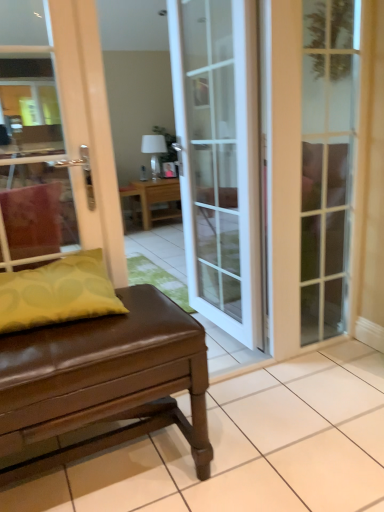
This screenshot has height=512, width=384. In order to click on yellow fabric pillow at left in this screenshot , I will do click(58, 292).

What do you see at coordinates (219, 158) in the screenshot? I see `white glass door at center, the second door in the right-to-left sequence` at bounding box center [219, 158].

In order to face clear glass door at right, the first door positioned from the right, should I rotate leftwards or rightwards?

You should rotate right by 17.655 degrees.

The image size is (384, 512). What do you see at coordinates (158, 199) in the screenshot?
I see `wooden table at center, the second table when ordered from front to back` at bounding box center [158, 199].

This screenshot has width=384, height=512. In order to click on yellow fabric pillow at left in this screenshot , I will do `click(58, 292)`.

From a real-world perspective, between clear glass door at right, arranged as the second door when viewed from the left, and white glass door at center, the second door in the right-to-left sequence, who is vertically lower?

In real-world perspective, clear glass door at right, arranged as the second door when viewed from the left, is lower.

What are the coordinates of `door below the white glass door at center, marked as the first door in a left-to-right arrangement (from a real-world perspective)` in the screenshot? It's located at (284, 172).

Is point (156, 161) positioned before point (227, 86)?

No, (156, 161) is further to viewer.

Is white glossy lampshade at center turned away from white glass door at center, marked as the first door in a left-to-right arrangement?

No.

Would you consider white glossy lampshade at center to be distant from white glass door at center, the second door in the right-to-left sequence?

Yes, white glossy lampshade at center is far from white glass door at center, the second door in the right-to-left sequence.

Is white glossy lampshade at center surrounding white glass door at center, the second door in the right-to-left sequence?

No, white glossy lampshade at center does not contain white glass door at center, the second door in the right-to-left sequence.

Is yellow fabric pillow at left surrounding brown leather bench at lower left, the 2th table when ordered from top to bottom?

No, brown leather bench at lower left, the 2th table when ordered from top to bottom, is located outside of yellow fabric pillow at left.

Are yellow fabric pillow at left and brown leather bench at lower left, which is the first table from front to back, far apart?

No.

Which of these two, yellow fabric pillow at left or brown leather bench at lower left, which is counted as the 2th table, starting from the back, is wider?

Wider between the two is brown leather bench at lower left, which is counted as the 2th table, starting from the back.

Which object is closer to the camera taking this photo, white glossy lampshade at center or clear glass door at right, the first door positioned from the right?

Positioned in front is clear glass door at right, the first door positioned from the right.

In terms of height, does white glossy lampshade at center look taller or shorter compared to clear glass door at right, arranged as the second door when viewed from the left?

In the image, white glossy lampshade at center appears to be shorter than clear glass door at right, arranged as the second door when viewed from the left.

Which object is positioned more to the left, white glass door at center, marked as the first door in a left-to-right arrangement, or wooden table at center, which is the second table from bottom to top?

wooden table at center, which is the second table from bottom to top, is more to the left.

Considering the relative positions of white glass door at center, marked as the first door in a left-to-right arrangement, and wooden table at center, the second table when ordered from front to back, in the image provided, is white glass door at center, marked as the first door in a left-to-right arrangement, in front of wooden table at center, the second table when ordered from front to back,?

Yes, white glass door at center, marked as the first door in a left-to-right arrangement, is closer to the camera.

Does white glass door at center, the second door in the right-to-left sequence, have a lesser height compared to wooden table at center, the second table when ordered from front to back?

No.

In the scene shown: Is white glass door at center, the second door in the right-to-left sequence, oriented away from wooden table at center, acting as the first table starting from the back?

No, white glass door at center, the second door in the right-to-left sequence, is not facing away from wooden table at center, acting as the first table starting from the back.

Is white glossy lampshade at center located within white glass door at center, the second door in the right-to-left sequence?

No, white glass door at center, the second door in the right-to-left sequence, does not contain white glossy lampshade at center.

Is white glass door at center, the second door in the right-to-left sequence, smaller than white glossy lampshade at center?

Actually, white glass door at center, the second door in the right-to-left sequence, might be larger than white glossy lampshade at center.

Which is closer to the camera, (x=185, y=162) or (x=151, y=149)?

Point (x=185, y=162).

From the image's perspective, between white glass door at center, marked as the first door in a left-to-right arrangement, and white glossy lampshade at center, which one is located above?

From the image's view, white glossy lampshade at center is above.

Would you say wooden table at center, the second table when ordered from front to back, is to the left or to the right of white glass door at center, marked as the first door in a left-to-right arrangement, in the picture?

In the image, wooden table at center, the second table when ordered from front to back, appears on the left side of white glass door at center, marked as the first door in a left-to-right arrangement.

Is white glass door at center, marked as the first door in a left-to-right arrangement, surrounded by wooden table at center, positioned as the 1th table in top-to-bottom order?

Answer: Definitely not — white glass door at center, marked as the first door in a left-to-right arrangement, is not inside wooden table at center, positioned as the 1th table in top-to-bottom order.

From the image's perspective, is wooden table at center, the second table when ordered from front to back, located above or below white glass door at center, marked as the first door in a left-to-right arrangement?

From the image's perspective, wooden table at center, the second table when ordered from front to back, appears above white glass door at center, marked as the first door in a left-to-right arrangement.

From a real-world perspective, who is located higher, wooden table at center, positioned as the 1th table in top-to-bottom order, or white glass door at center, marked as the first door in a left-to-right arrangement?

white glass door at center, marked as the first door in a left-to-right arrangement, is physically above.

Where is `door above the clear glass door at right, the first door positioned from the right (from the image's perspective)`? door above the clear glass door at right, the first door positioned from the right (from the image's perspective) is located at coordinates (219, 158).

You are a GUI agent. You are given a task and a screenshot of the screen. Output one action in this format:
    pyautogui.click(x=<x>, y=<y>)
    Task: Click on the 2nd door in front of the white glossy lampshade at center
    This screenshot has height=512, width=384.
    Given the screenshot: What is the action you would take?
    pyautogui.click(x=219, y=158)

Which object lies further to the anchor point yellow fabric pillow at left, brown leather bench at lower left, which is the first table from front to back, or white glass door at center, marked as the first door in a left-to-right arrangement?

white glass door at center, marked as the first door in a left-to-right arrangement, is positioned further to the anchor yellow fabric pillow at left.

Estimate the real-world distances between objects in this image. Which object is closer to white glass door at center, the second door in the right-to-left sequence, wooden table at center, the second table when ordered from front to back, or yellow fabric pillow at left?

Based on the image, yellow fabric pillow at left appears to be nearer to white glass door at center, the second door in the right-to-left sequence.

Estimate the real-world distances between objects in this image. Which object is closer to yellow fabric pillow at left, wooden table at center, which is the second table from bottom to top, or white glossy lampshade at center?

wooden table at center, which is the second table from bottom to top, lies closer to yellow fabric pillow at left than the other object.

Looking at the image, which one is located further to wooden table at center, positioned as the 1th table in top-to-bottom order, white glass door at center, the second door in the right-to-left sequence, or white glossy lampshade at center?

white glass door at center, the second door in the right-to-left sequence.

Estimate the real-world distances between objects in this image. Which object is closer to white glossy lampshade at center, yellow fabric pillow at left or wooden table at center, acting as the first table starting from the back?

wooden table at center, acting as the first table starting from the back, lies closer to white glossy lampshade at center than the other object.

Estimate the real-world distances between objects in this image. Which object is closer to wooden table at center, positioned as the 1th table in top-to-bottom order, brown leather bench at lower left, which is the first table from bottom to top, or white glossy lampshade at center?

white glossy lampshade at center lies closer to wooden table at center, positioned as the 1th table in top-to-bottom order, than the other object.

From the picture: Based on their spatial positions, is white glass door at center, marked as the first door in a left-to-right arrangement, or brown leather bench at lower left, which is counted as the 2th table, starting from the back, closer to white glossy lampshade at center?

white glass door at center, marked as the first door in a left-to-right arrangement, is closer to white glossy lampshade at center.

When comparing their distances from white glass door at center, marked as the first door in a left-to-right arrangement, does white glossy lampshade at center or brown leather bench at lower left, which is the first table from front to back, seem closer?

brown leather bench at lower left, which is the first table from front to back.

The height and width of the screenshot is (512, 384). Find the location of `pillow between brown leather bench at lower left, which is the first table from front to back, and white glossy lampshade at center in the front-back direction`. pillow between brown leather bench at lower left, which is the first table from front to back, and white glossy lampshade at center in the front-back direction is located at coordinates (58, 292).

Where is `pillow located between brown leather bench at lower left, which is the first table from bottom to top, and wooden table at center, which is the second table from bottom to top, in the depth direction`? The image size is (384, 512). pillow located between brown leather bench at lower left, which is the first table from bottom to top, and wooden table at center, which is the second table from bottom to top, in the depth direction is located at coordinates (58, 292).

Where is `pillow between white glass door at center, the second door in the right-to-left sequence, and brown leather bench at lower left, which is the first table from bottom to top, in the up-down direction`? The image size is (384, 512). pillow between white glass door at center, the second door in the right-to-left sequence, and brown leather bench at lower left, which is the first table from bottom to top, in the up-down direction is located at coordinates (58, 292).

The image size is (384, 512). I want to click on door between white glass door at center, marked as the first door in a left-to-right arrangement, and wooden table at center, acting as the first table starting from the back, from front to back, so click(284, 172).